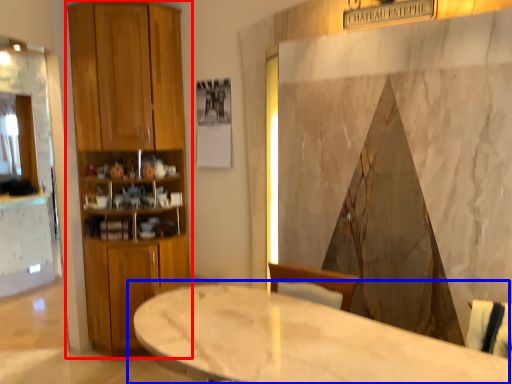
Question: Which object appears farthest to the camera in this image, closet (highlighted by a red box) or table (highlighted by a blue box)?

Choices:
 (A) closet
 (B) table

Answer: (A)